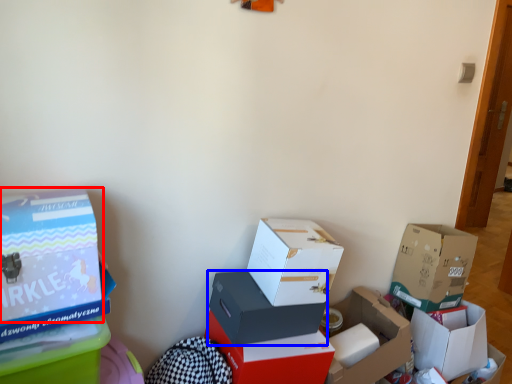
Question: Which object appears farthest to the camera in this image, box (highlighted by a red box) or box (highlighted by a blue box)?

Choices:
 (A) box
 (B) box

Answer: (B)